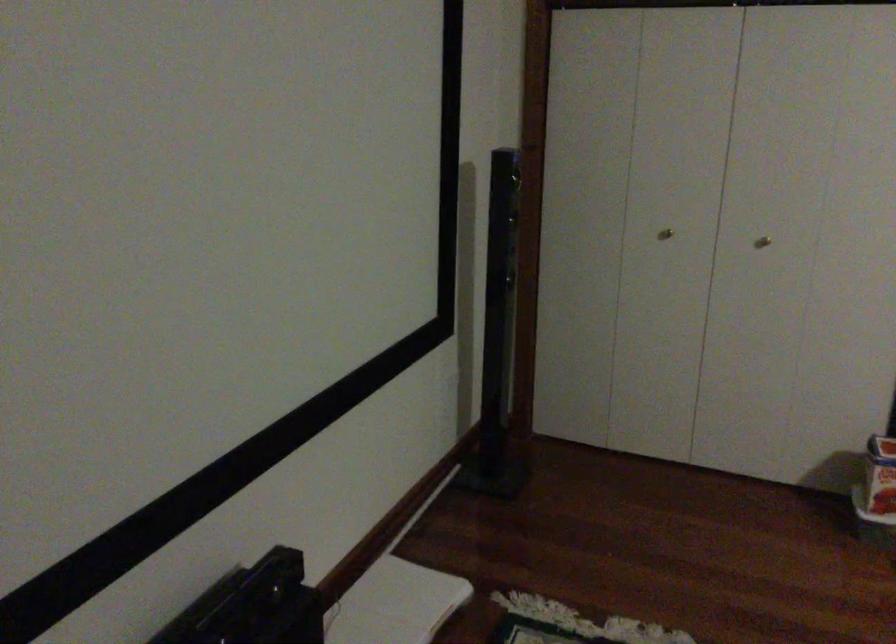
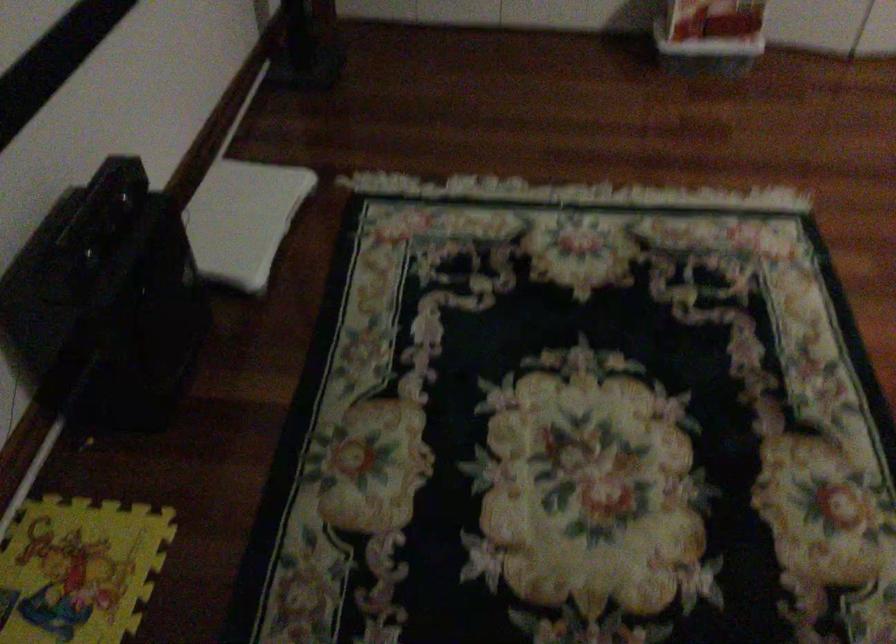
Question: The images are taken continuously from a first-person perspective. In which direction is your viewpoint rotating?

Choices:
 (A) Left
 (B) Right
 (C) Up
 (D) Down

Answer: (D)